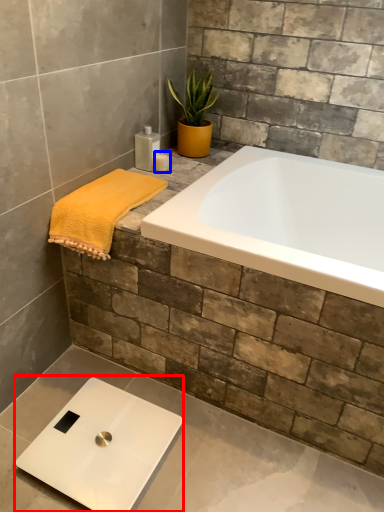
Question: Among these objects, which one is farthest to the camera, scale (highlighted by a red box) or toiletry (highlighted by a blue box)?

Choices:
 (A) scale
 (B) toiletry

Answer: (B)